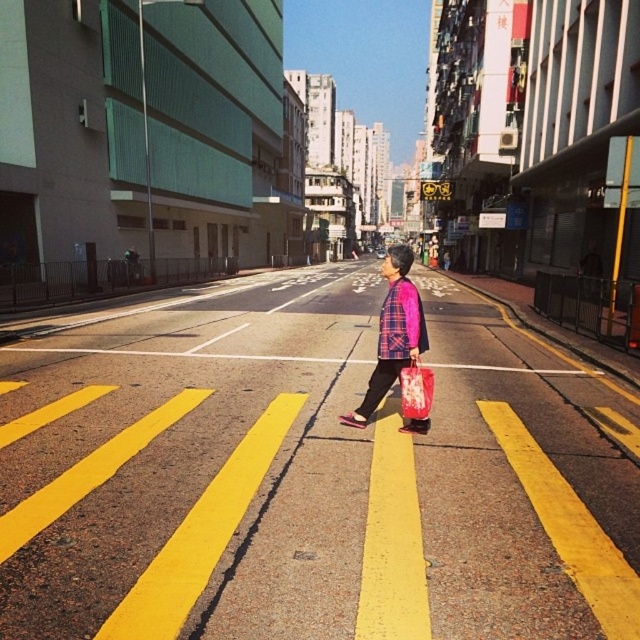
Which is more to the right, plaid fabric shirt at center or matte pink shopping bag at center?

plaid fabric shirt at center is more to the right.

Can you confirm if plaid fabric shirt at center is positioned to the right of matte pink shopping bag at center?

Yes, plaid fabric shirt at center is to the right of matte pink shopping bag at center.

Describe the element at coordinates (394, 332) in the screenshot. I see `plaid fabric shirt at center` at that location.

In order to click on plaid fabric shirt at center in this screenshot , I will do `click(394, 332)`.